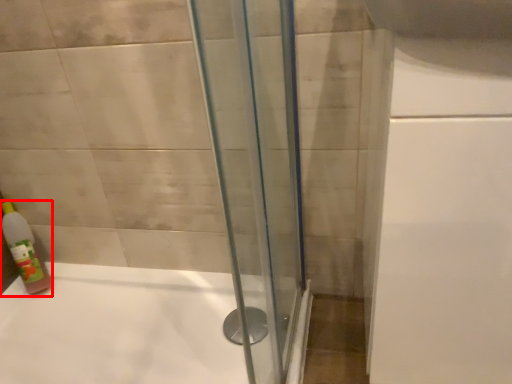
Question: From the image, what is the correct spatial relationship of bottle (annotated by the red box) in relation to bathtub?

Choices:
 (A) left
 (B) right

Answer: (A)